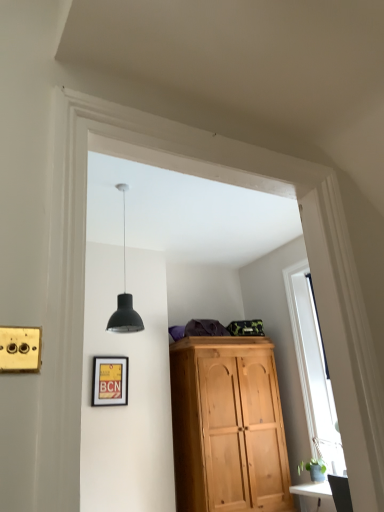
Locate an element on the screen. transparent glass window at right is located at coordinates (312, 367).

In order to face matte yellow picture frame at lower left, should I rotate leftwards or rightwards?

Turn left approximately 10.910 degrees to face it.

What do you see at coordinates (110, 381) in the screenshot? I see `matte yellow picture frame at lower left` at bounding box center [110, 381].

This screenshot has width=384, height=512. I want to click on transparent glass window at right, so click(312, 367).

Consider the image. From the image's perspective, is matte yellow picture frame at lower left positioned above or below matte black lampshade at center?

From the image's perspective, matte yellow picture frame at lower left appears below matte black lampshade at center.

Is matte black lampshade at center at the back of matte yellow picture frame at lower left?

matte yellow picture frame at lower left does not have its back to matte black lampshade at center.

Where is `picture frame on the left side of matte black lampshade at center`? The width and height of the screenshot is (384, 512). picture frame on the left side of matte black lampshade at center is located at coordinates [110, 381].

Looking at this image, is matte yellow picture frame at lower left in front of or behind matte black lampshade at center in the image?

matte yellow picture frame at lower left is behind matte black lampshade at center.

Image resolution: width=384 pixels, height=512 pixels. I want to click on window lying above the matte yellow picture frame at lower left (from the image's perspective), so click(x=312, y=367).

From a real-world perspective, is matte yellow picture frame at lower left above or below transparent glass window at right?

matte yellow picture frame at lower left is below transparent glass window at right.

Is point (100, 393) closer or farther from the camera than point (338, 444)?

Point (100, 393) is farther from the camera than point (338, 444).

Does matte yellow picture frame at lower left have a greater width compared to transparent glass window at right?

Indeed, matte yellow picture frame at lower left has a greater width compared to transparent glass window at right.

Which of these two, matte black lampshade at center or transparent glass window at right, is bigger?

Bigger between the two is transparent glass window at right.

Considering the positions of points (129, 302) and (301, 292), is point (129, 302) farther from camera compared to point (301, 292)?

No, it is in front of (301, 292).

Is matte black lampshade at center situated inside transparent glass window at right or outside?

matte black lampshade at center lies outside transparent glass window at right.

At what (x,y) coordinates should I click in order to perform the action: click on light fixture that is on the right side of matte yellow picture frame at lower left. Please return your answer as a coordinate pair (x, y). Looking at the image, I should click on (124, 297).

From a real-world perspective, relative to matte yellow picture frame at lower left, is matte black lampshade at center vertically above or below?

In terms of real-world spatial position, matte black lampshade at center is above matte yellow picture frame at lower left.

Could you tell me if matte black lampshade at center is facing matte yellow picture frame at lower left?

No.

Is point (309, 346) positioned after point (141, 323)?

Yes, point (309, 346) is farther from viewer.

Is transparent glass window at right not near matte black lampshade at center?

That's right, there is a large distance between transparent glass window at right and matte black lampshade at center.

Does transparent glass window at right appear on the right side of matte black lampshade at center?

Correct, you'll find transparent glass window at right to the right of matte black lampshade at center.

Does transparent glass window at right come behind matte yellow picture frame at lower left?

No, it is not.

How many degrees apart are the facing directions of transparent glass window at right and matte yellow picture frame at lower left?

The angle between the facing direction of transparent glass window at right and the facing direction of matte yellow picture frame at lower left is 1.13 degrees.

Does transparent glass window at right have a larger size compared to matte yellow picture frame at lower left?

Yes.

From the image's perspective, which is above, transparent glass window at right or matte yellow picture frame at lower left?

transparent glass window at right.

Find the location of a particular element. This screenshot has height=512, width=384. picture frame that is on the left side of matte black lampshade at center is located at coordinates (110, 381).

This screenshot has width=384, height=512. Find the location of `window located on the right of matte yellow picture frame at lower left`. window located on the right of matte yellow picture frame at lower left is located at coordinates (312, 367).

Looking at the image, which one is located further to transparent glass window at right, matte yellow picture frame at lower left or matte black lampshade at center?

matte black lampshade at center.

When comparing their distances from matte black lampshade at center, does transparent glass window at right or matte yellow picture frame at lower left seem closer?

matte yellow picture frame at lower left.

Considering their positions, is transparent glass window at right positioned further to matte yellow picture frame at lower left than matte black lampshade at center?

Among the two, transparent glass window at right is located further to matte yellow picture frame at lower left.

Based on their spatial positions, is matte black lampshade at center or transparent glass window at right further from matte yellow picture frame at lower left?

transparent glass window at right.

Looking at this image, considering their positions, is matte black lampshade at center positioned closer to transparent glass window at right than matte yellow picture frame at lower left?

matte yellow picture frame at lower left.

When comparing their distances from matte black lampshade at center, does matte yellow picture frame at lower left or transparent glass window at right seem further?

The object further to matte black lampshade at center is transparent glass window at right.

Locate an element on the screen. The height and width of the screenshot is (512, 384). light fixture between matte yellow picture frame at lower left and transparent glass window at right is located at coordinates (124, 297).